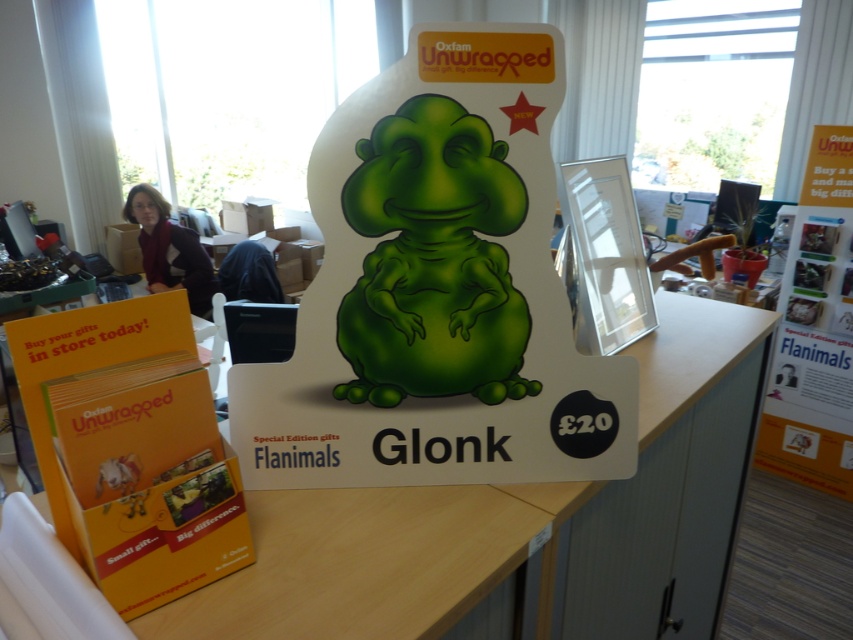
You are at the Oxfam Unwrapped charity gift shop and see the point marked at coordinate (520, 522). Where exactly is this point located in relation to the white matte table at center?

The point at coordinate (520, 522) is located on the white matte table at center.

Looking at this image, you are standing in front of the Oxfam Unwrapped promotional display and see two points labeled as point (750, 429) and point (798, 248). Which point is nearer to you?

Point (750, 429) is closer to the camera than point (798, 248), so the point labeled (750, 429) is nearer to you.

You are a customer in the Oxfam Unwrapped shop and want to place a gift card on the white matte table at center. However, you need to ensure that the gift card won not block the view of the white paper poster at upper right. Can you do this?

The white matte table at center is in front of the white paper poster at upper right, so placing the gift card on the table may block the view of the poster. To avoid blocking it, place the gift card towards the edge of the table closest to you, ensuring the poster remains visible.